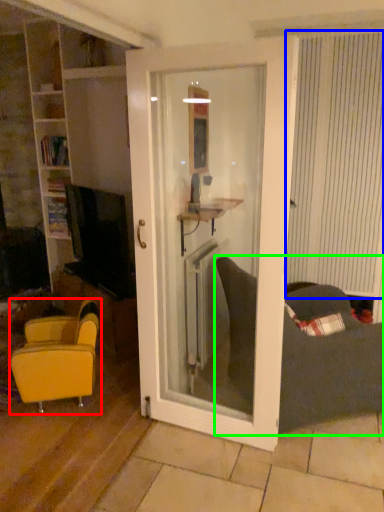
Question: Considering the real-world distances, which object is farthest from chair (highlighted by a red box)? curtain (highlighted by a blue box) or studio couch (highlighted by a green box)?

Choices:
 (A) curtain
 (B) studio couch

Answer: (A)